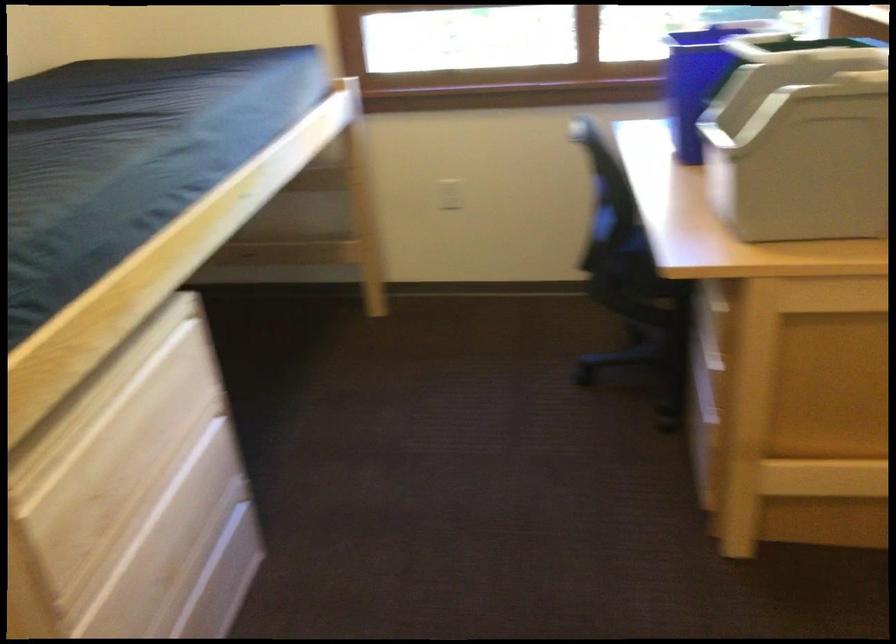
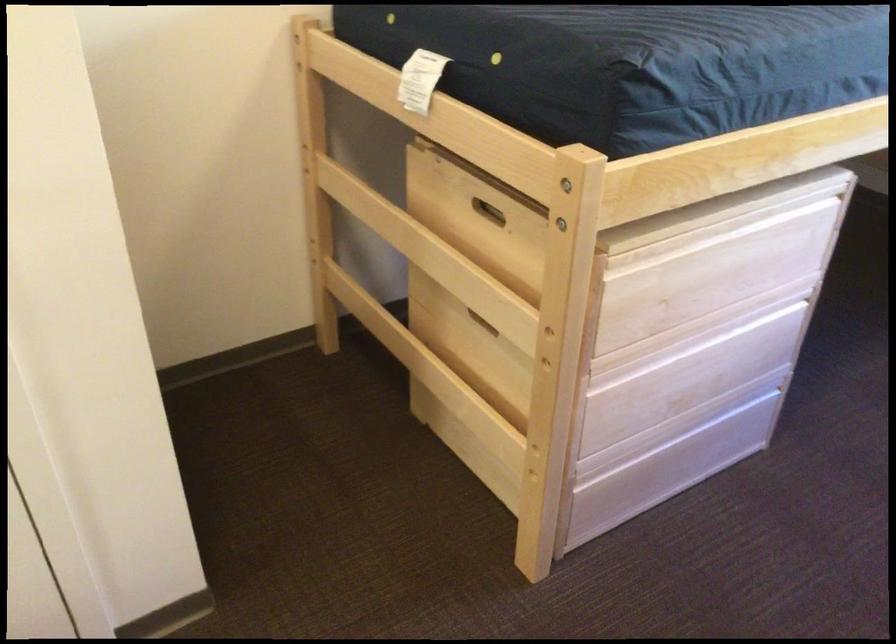
Based on the continuous images, in which direction is the camera rotating?

The camera's rotation is toward left-down.